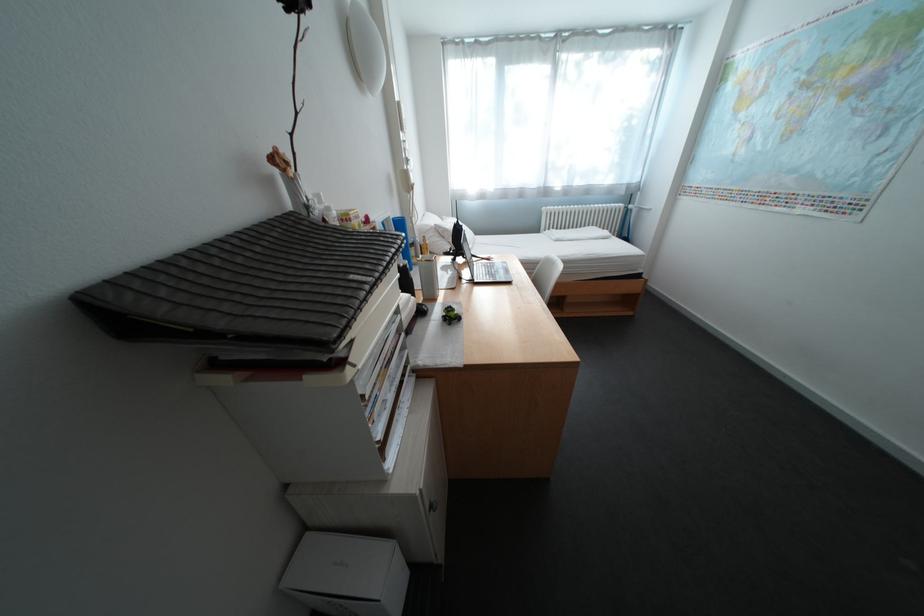
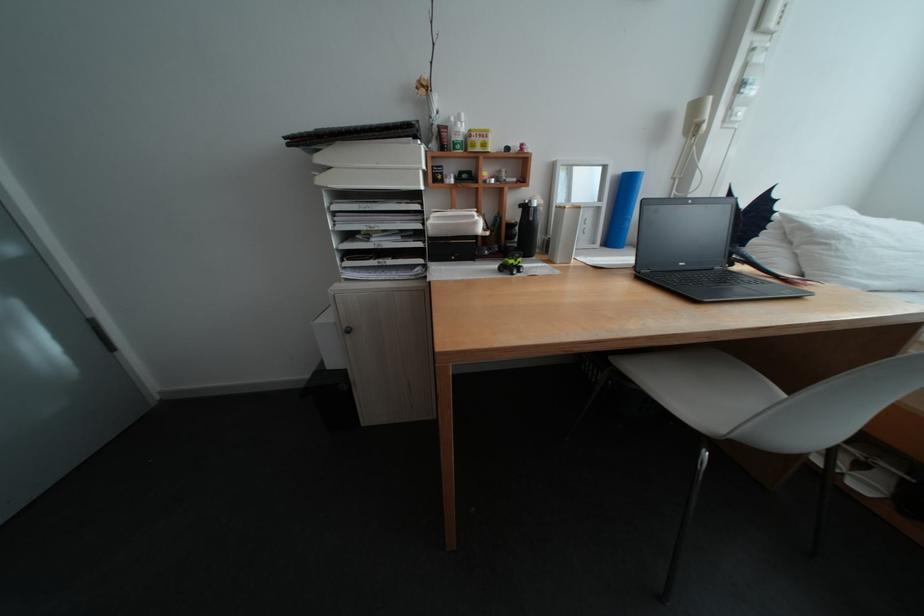
Locate, in the second image, the point that corresponds to point 365,217 in the first image.

(485, 135)